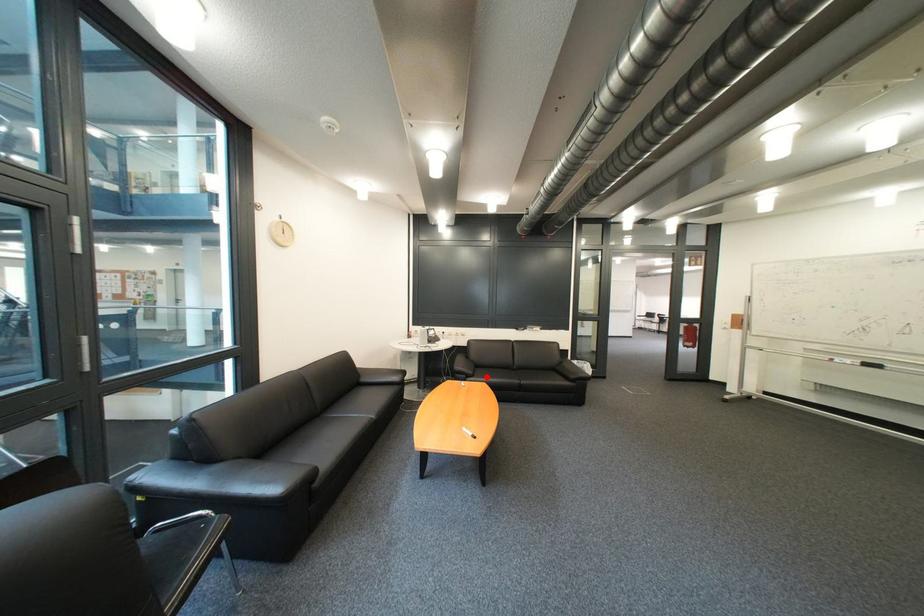
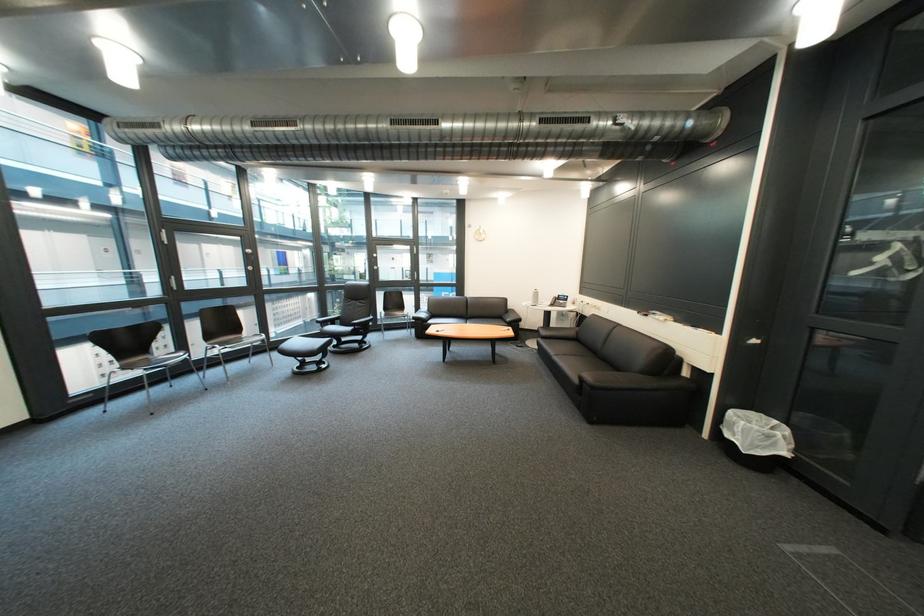
Question: A red point is marked in image1. In image2, is the corresponding 3D point closer to the camera or farther? Reply with the corresponding letter.

Choices:
 (A) The corresponding 3D point is closer.
 (B) The corresponding 3D point is farther.

Answer: (A)